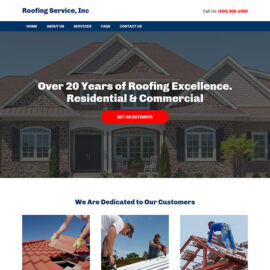
At what (x,y) coordinates should I click in order to perform the action: click on front entry door. Please return your answer as a coordinate pair (x, y). The image size is (270, 270). Looking at the image, I should click on (87, 151).